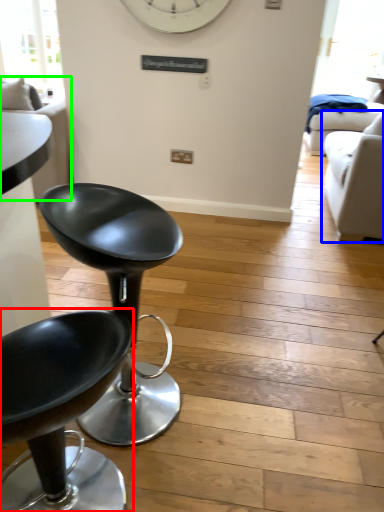
Question: Considering the real-world distances, which object is closest to chair (highlighted by a red box)? studio couch (highlighted by a blue box) or couch (highlighted by a green box).

Choices:
 (A) studio couch
 (B) couch

Answer: (B)